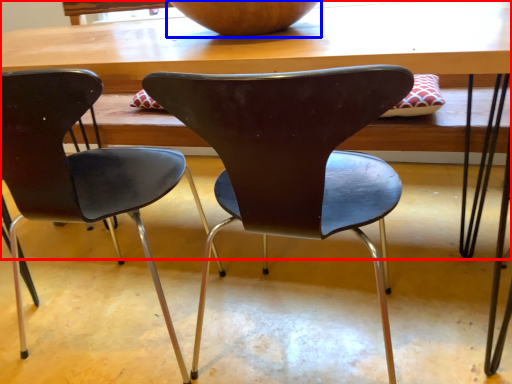
Question: Which object is further to the camera taking this photo, table (highlighted by a red box) or bowl (highlighted by a blue box)?

Choices:
 (A) table
 (B) bowl

Answer: (B)